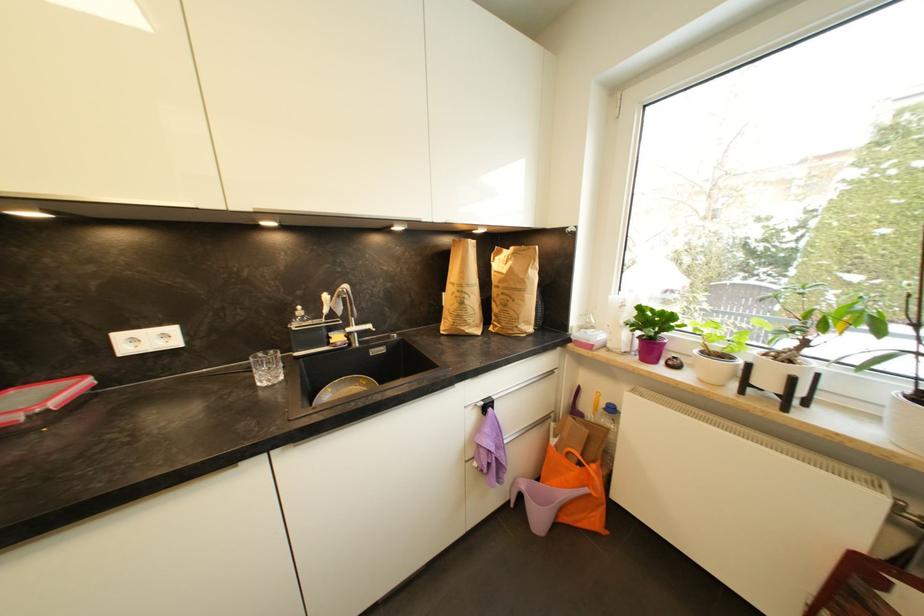
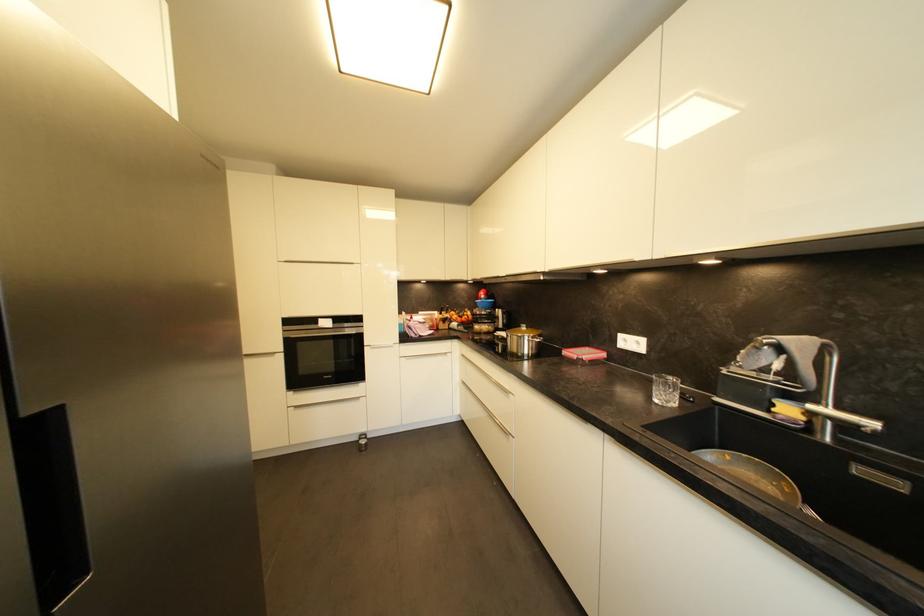
In the second image, find the point that corresponds to (368,387) in the first image.

(787, 493)